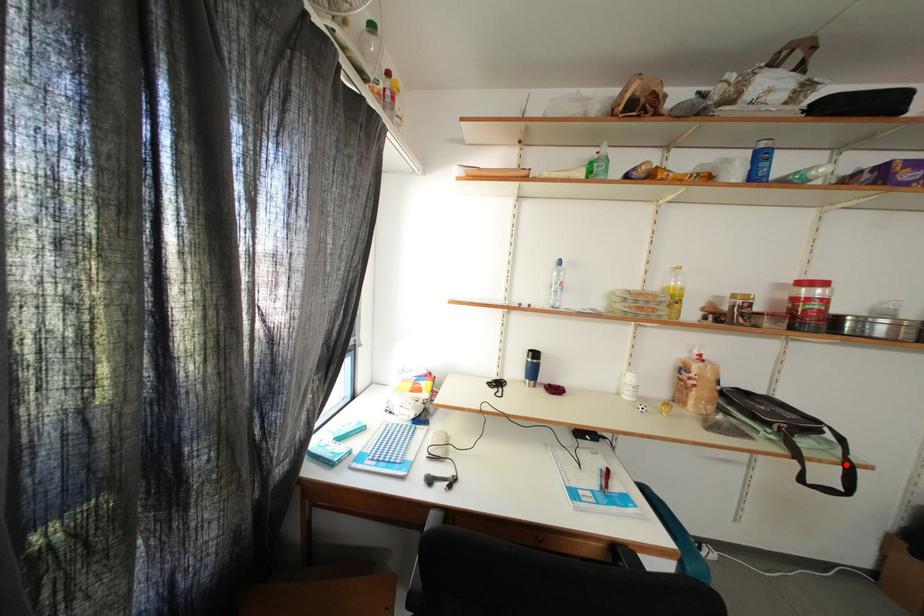
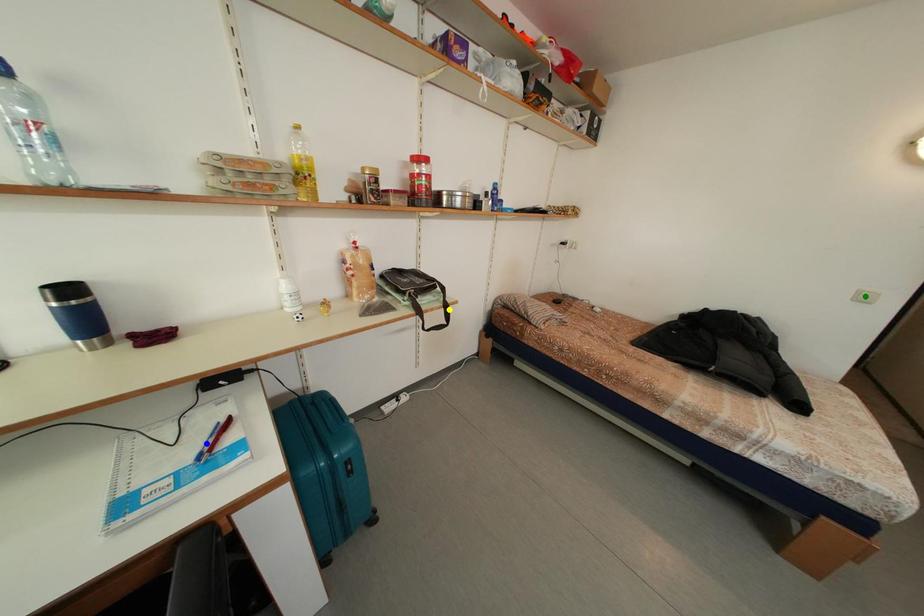
Question: I am providing you with two images of the same scene from different viewpoints. A red point is marked on the first image. You are given multiple points on the second image. Which spot in image 2 lines up with the point in image 1?

Choices:
 (A) yellow point
 (B) blue point
 (C) green point

Answer: (A)